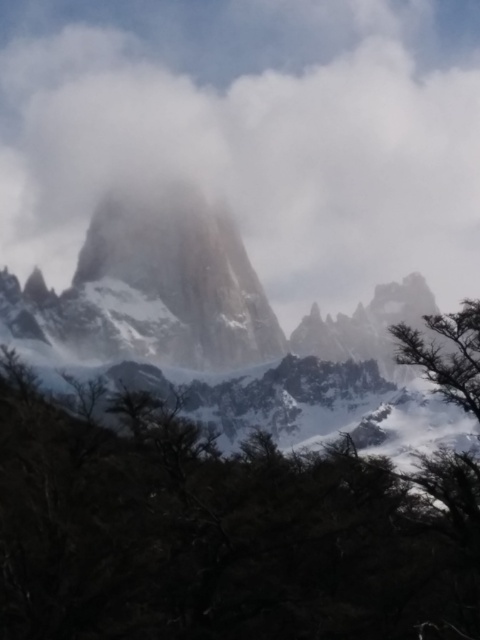
Is point (124, 465) positioned behind point (92, 218)?

No, it is not.

Can you confirm if dark green leafy tree at center is wider than sandy beige rock at center?

Correct, the width of dark green leafy tree at center exceeds that of sandy beige rock at center.

This screenshot has height=640, width=480. In order to click on dark green leafy tree at center in this screenshot , I will do `click(219, 532)`.

Which of these two, white fluffy cloud at upper center or sandy beige rock at center, stands shorter?

Standing shorter between the two is sandy beige rock at center.

Looking at this image, does white fluffy cloud at upper center appear on the right side of sandy beige rock at center?

Correct, you'll find white fluffy cloud at upper center to the right of sandy beige rock at center.

This screenshot has height=640, width=480. Describe the element at coordinates (253, 132) in the screenshot. I see `white fluffy cloud at upper center` at that location.

Locate an element on the screen. The image size is (480, 640). white fluffy cloud at upper center is located at coordinates (253, 132).

How distant is white fluffy cloud at upper center from dark green leafy tree at center?

white fluffy cloud at upper center and dark green leafy tree at center are 295.30 feet apart from each other.

Locate an element on the screen. white fluffy cloud at upper center is located at coordinates (253, 132).

This screenshot has width=480, height=640. I want to click on white fluffy cloud at upper center, so click(253, 132).